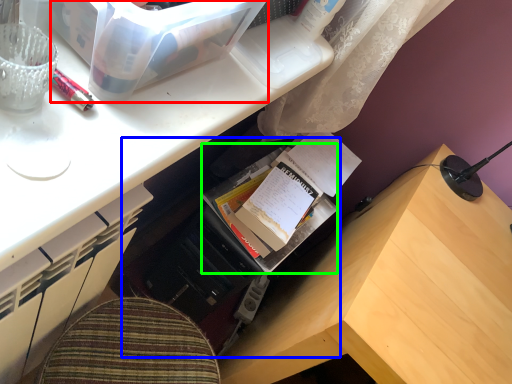
Question: Which object is the closest to the storage box (highlighted by a red box)? Choose among these: bookshelf (highlighted by a blue box) or book (highlighted by a green box).

Choices:
 (A) bookshelf
 (B) book

Answer: (B)